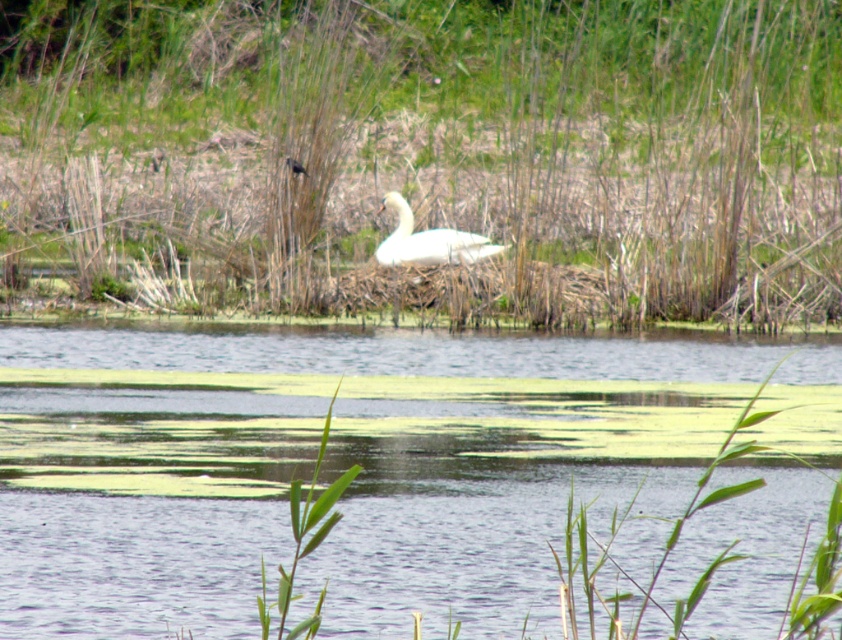
Question: Among these objects, which one is farthest from the camera?

Choices:
 (A) clear water at center
 (B) white glossy swan at center
 (C) silvery metallic bird at center

Answer: (C)

Question: Can you confirm if green grass at center is wider than white glossy swan at center?

Choices:
 (A) yes
 (B) no

Answer: (A)

Question: Is white glossy swan at center bigger than silvery metallic bird at center?

Choices:
 (A) no
 (B) yes

Answer: (B)

Question: Does green grass at center appear under clear water at center?

Choices:
 (A) no
 (B) yes

Answer: (A)

Question: Which point is closer to the camera taking this photo?

Choices:
 (A) (525, 556)
 (B) (291, 161)
 (C) (437, 230)
 (D) (515, 214)

Answer: (A)

Question: Based on their relative distances, which object is farther from the silvery metallic bird at center?

Choices:
 (A) green grass at center
 (B) white glossy swan at center
 (C) clear water at center

Answer: (A)